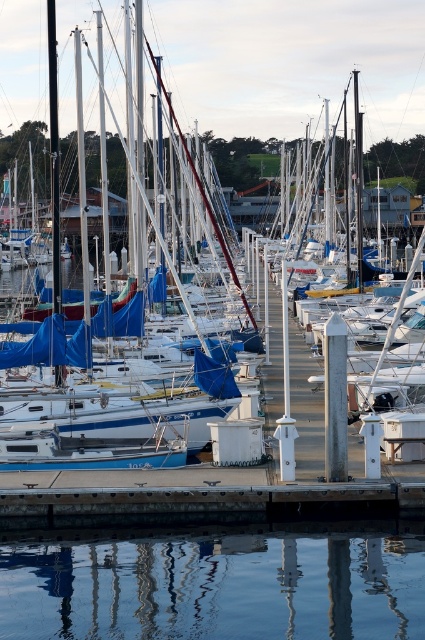
Does transparent water at center appear under blue tarpaulin sailboat at center?

Yes.

Which is in front, point (377, 556) or point (87, 244)?

Point (377, 556) is more forward.

Image resolution: width=425 pixels, height=640 pixels. What are the coordinates of `transparent water at center` in the screenshot? It's located at [215, 586].

How distant is smooth concrete dock at center from blue tarpaulin sailboat at center?

smooth concrete dock at center and blue tarpaulin sailboat at center are 23.57 meters apart from each other.

Can you confirm if smooth concrete dock at center is positioned above blue tarpaulin sailboat at center?

No, smooth concrete dock at center is not above blue tarpaulin sailboat at center.

Is point (11, 524) positioned in front of point (192, 324)?

Yes, point (11, 524) is in front of point (192, 324).

Where is `smooth concrete dock at center`? The image size is (425, 640). smooth concrete dock at center is located at coordinates tap(195, 497).

Who is more distant from viewer, (396,544) or (367,500)?

Point (367,500)

Based on the photo, between transparent water at center and smooth concrete dock at center, which one is positioned lower?

Positioned lower is transparent water at center.

The height and width of the screenshot is (640, 425). What do you see at coordinates (215, 586) in the screenshot? I see `transparent water at center` at bounding box center [215, 586].

In order to click on transparent water at center in this screenshot , I will do `click(215, 586)`.